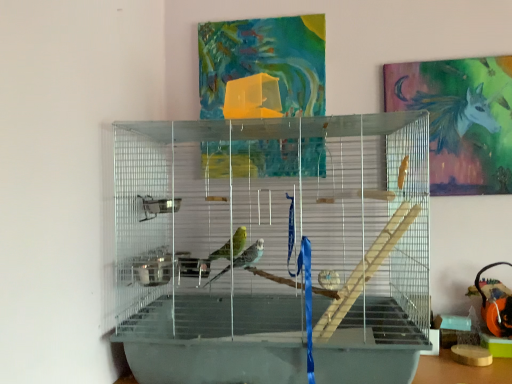
Based on the photo, what is the approximate width of clear plastic birdcage at center?

clear plastic birdcage at center is 15.51 inches in width.

Where is `clear plastic birdcage at center`? The height and width of the screenshot is (384, 512). clear plastic birdcage at center is located at coordinates (272, 248).

The image size is (512, 384). What do you see at coordinates (272, 248) in the screenshot?
I see `clear plastic birdcage at center` at bounding box center [272, 248].

In order to face metallic unicorn at upper right, should I rotate leftwards or rightwards?

Rotate your view right by about 25.296°.

What do you see at coordinates (454, 112) in the screenshot?
I see `metallic unicorn at upper right` at bounding box center [454, 112].

At what (x,y) coordinates should I click in order to perform the action: click on metallic unicorn at upper right. Please return your answer as a coordinate pair (x, y). Looking at the image, I should click on (454, 112).

The image size is (512, 384). What are the coordinates of `clear plastic birdcage at center` in the screenshot? It's located at (272, 248).

Between metallic unicorn at upper right and clear plastic birdcage at center, which one appears on the left side from the viewer's perspective?

clear plastic birdcage at center is more to the left.

Is the depth of metallic unicorn at upper right greater than that of clear plastic birdcage at center?

Yes, it is.

Is point (442, 145) positioned in front of point (216, 230)?

No, it is not.

Consider the image. From the image's perspective, would you say metallic unicorn at upper right is shown under clear plastic birdcage at center?

No, from the image's perspective, metallic unicorn at upper right is not beneath clear plastic birdcage at center.

From a real-world perspective, is metallic unicorn at upper right below clear plastic birdcage at center?

No, from a real-world perspective, metallic unicorn at upper right is not under clear plastic birdcage at center.

Does metallic unicorn at upper right have a lesser width compared to clear plastic birdcage at center?

Yes, metallic unicorn at upper right is thinner than clear plastic birdcage at center.

In terms of height, does metallic unicorn at upper right look taller or shorter compared to clear plastic birdcage at center?

metallic unicorn at upper right is shorter than clear plastic birdcage at center.

Is metallic unicorn at upper right smaller than clear plastic birdcage at center?

Yes.

Based on the photo, is metallic unicorn at upper right spatially inside clear plastic birdcage at center, or outside of it?

metallic unicorn at upper right is spatially situated outside clear plastic birdcage at center.

Are metallic unicorn at upper right and clear plastic birdcage at center located far from each other?

No, metallic unicorn at upper right is not far from clear plastic birdcage at center.

Is metallic unicorn at upper right facing away from clear plastic birdcage at center?

No, metallic unicorn at upper right's orientation is not away from clear plastic birdcage at center.

How different are the orientations of metallic unicorn at upper right and clear plastic birdcage at center in degrees?

They differ by 4.47 degrees in their facing directions.

Image resolution: width=512 pixels, height=384 pixels. What are the coordinates of `animal above the clear plastic birdcage at center (from a real-world perspective)` in the screenshot? It's located at (454, 112).

Between clear plastic birdcage at center and metallic unicorn at upper right, which one appears on the right side from the viewer's perspective?

Positioned to the right is metallic unicorn at upper right.

Is clear plastic birdcage at center closer to the viewer compared to metallic unicorn at upper right?

Yes, the depth of clear plastic birdcage at center is less than that of metallic unicorn at upper right.

In the scene shown: Which point is more distant from viewer, (429, 328) or (462, 123)?

The point (462, 123) is farther from the camera.

From the image's perspective, which one is positioned lower, clear plastic birdcage at center or metallic unicorn at upper right?

From the image's view, clear plastic birdcage at center is below.

From a real-world perspective, is clear plastic birdcage at center physically located above or below metallic unicorn at upper right?

In terms of real-world spatial position, clear plastic birdcage at center is below metallic unicorn at upper right.

Which object is wider, clear plastic birdcage at center or metallic unicorn at upper right?

clear plastic birdcage at center is wider.

In terms of height, does clear plastic birdcage at center look taller or shorter compared to metallic unicorn at upper right?

Considering their sizes, clear plastic birdcage at center has more height than metallic unicorn at upper right.

Considering the sizes of clear plastic birdcage at center and metallic unicorn at upper right in the image, is clear plastic birdcage at center bigger or smaller than metallic unicorn at upper right?

Considering their sizes, clear plastic birdcage at center takes up more space than metallic unicorn at upper right.

Can we say clear plastic birdcage at center lies outside metallic unicorn at upper right?

clear plastic birdcage at center is positioned outside metallic unicorn at upper right.

Would you consider clear plastic birdcage at center to be distant from metallic unicorn at upper right?

No, there isn't a large distance between clear plastic birdcage at center and metallic unicorn at upper right.

Could you tell me if clear plastic birdcage at center is turned towards metallic unicorn at upper right?

No, clear plastic birdcage at center is not oriented towards metallic unicorn at upper right.

How many degrees apart are the facing directions of clear plastic birdcage at center and metallic unicorn at upper right?

The facing directions of clear plastic birdcage at center and metallic unicorn at upper right are 4.47 degrees apart.

At what (x,y) coordinates should I click in order to perform the action: click on animal lying on the right of clear plastic birdcage at center. Please return your answer as a coordinate pair (x, y). Image resolution: width=512 pixels, height=384 pixels. Looking at the image, I should click on (454, 112).

The width and height of the screenshot is (512, 384). I want to click on bird cage on the left of metallic unicorn at upper right, so tap(272, 248).

The image size is (512, 384). Identify the location of bird cage in front of the metallic unicorn at upper right. (272, 248).